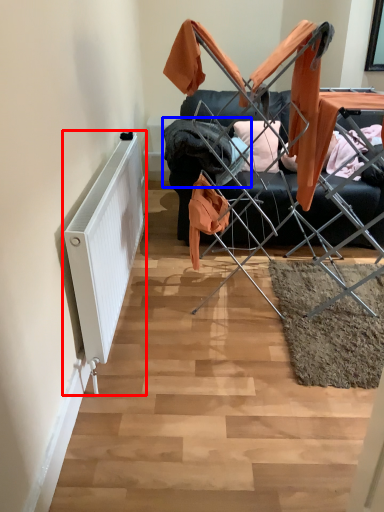
Question: Which object is further to the camera taking this photo, radiator (highlighted by a red box) or clothing (highlighted by a blue box)?

Choices:
 (A) radiator
 (B) clothing

Answer: (B)